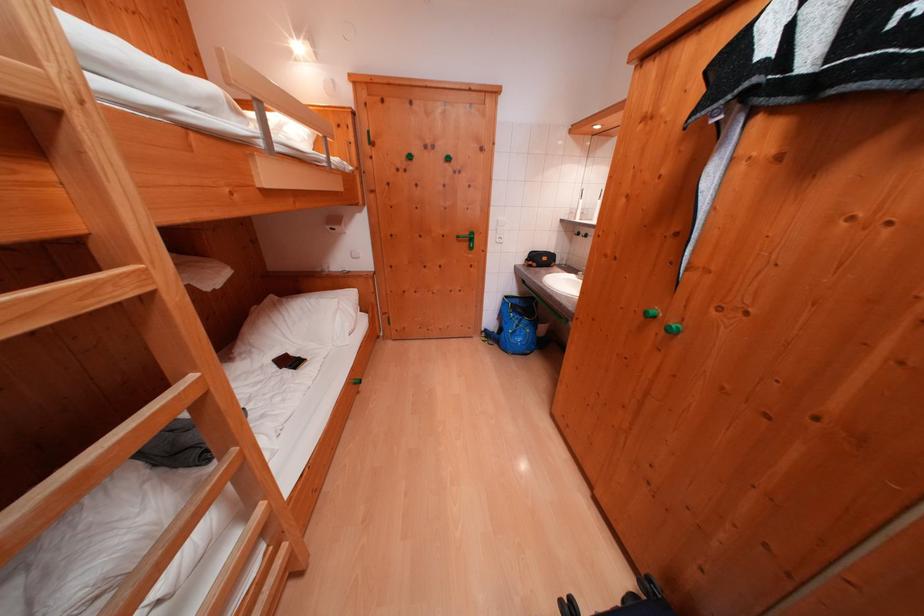
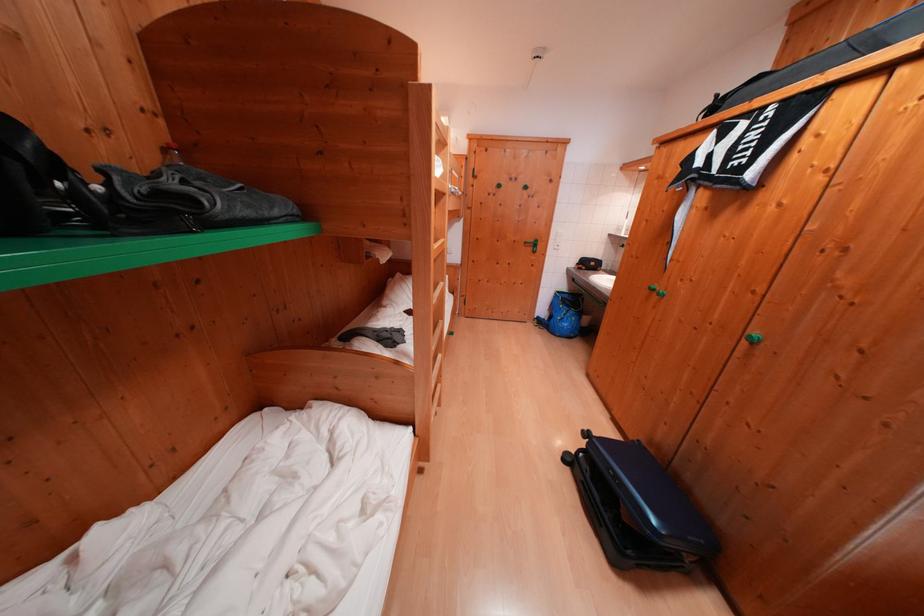
Question: How did the camera likely rotate?

Choices:
 (A) Left
 (B) Right
 (C) Up
 (D) Down

Answer: (A)